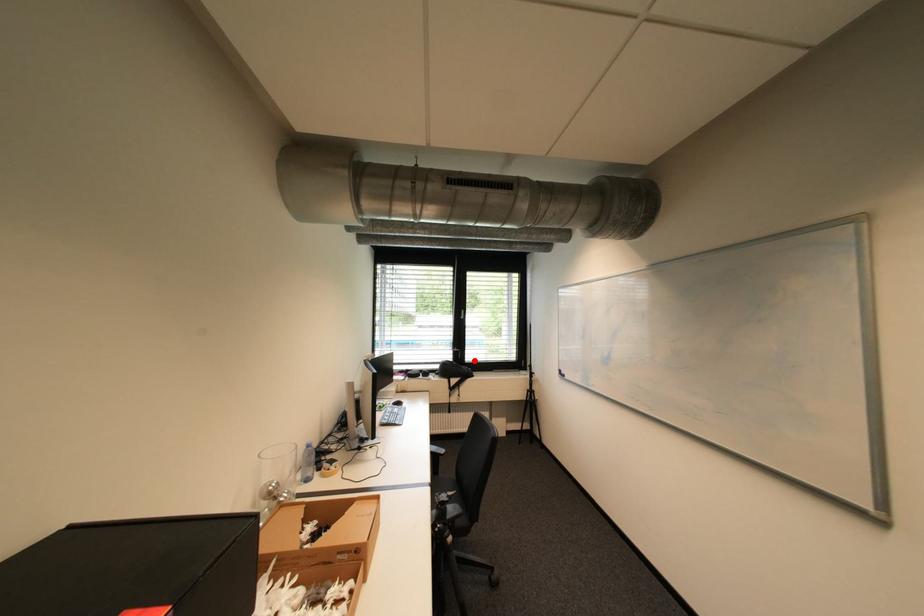
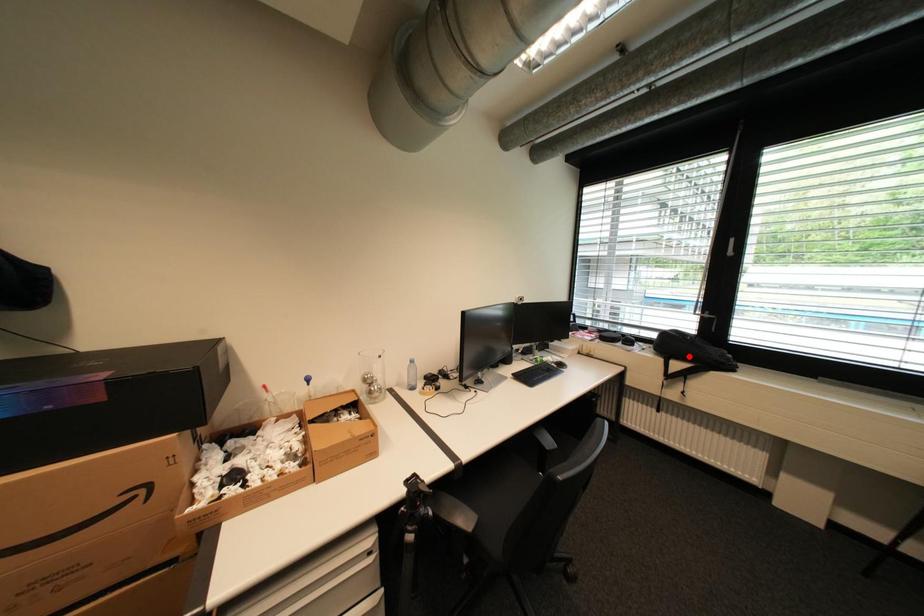
I am providing you with two images of the same scene from different viewpoints. A red point is marked on the first image and another point is marked on the second image. Are the points marked in image1 and image2 representing the same 3D position?

No